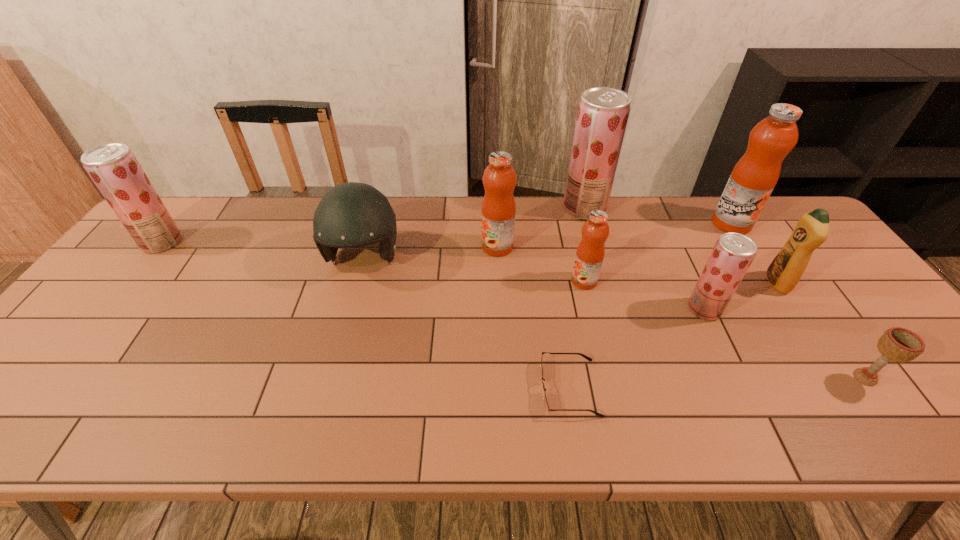
Find the location of a particular element. The image size is (960, 540). free space located on the front label of the biggest orange fruit juice is located at coordinates (752, 255).

What are the coordinates of `vacant space situated 0.220m on the right of the leftmost object` in the screenshot? It's located at (253, 242).

Where is `free location located on the front label of the fifth fruit juice from right to left`? free location located on the front label of the fifth fruit juice from right to left is located at coordinates (397, 247).

Identify the location of free region located 0.100m on the front label of the fifth fruit juice from right to left. This screenshot has height=540, width=960. (447, 247).

Locate an element on the screen. This screenshot has width=960, height=540. vacant area situated 0.360m on the front label of the fifth fruit juice from right to left is located at coordinates (361, 247).

You are a GUI agent. You are given a task and a screenshot of the screen. Output one action in this format:
    pyautogui.click(x=<x>, y=<y>)
    Task: Click on the vacant space located 0.120m on the label of the detergent
    
    Given the screenshot: What is the action you would take?
    pyautogui.click(x=724, y=282)

In order to click on free region located 0.140m on the label of the detergent in this screenshot , I will do `click(716, 282)`.

The height and width of the screenshot is (540, 960). Find the location of `free space located 0.330m on the label of the detergent`. free space located 0.330m on the label of the detergent is located at coordinates (647, 282).

Identify the location of free space located at the face opening of the green football helmet. (338, 352).

Locate an element on the screen. Image resolution: width=960 pixels, height=540 pixels. vacant region located on the back of the second fruit juice from right to left is located at coordinates (673, 243).